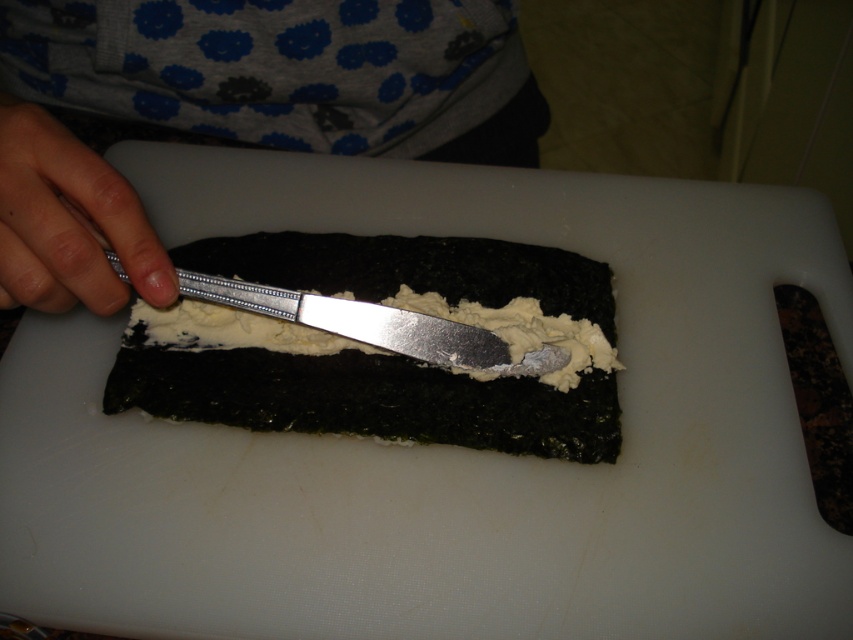
You are a chef standing at the counter and want to reach the point at coordinate point (134, 387). Your arm can extend 24 inches. Can you reach it?

The distance between point (134, 387) and the camera is 24.83 inches. Since your arm can only extend 24 inches, you cannot reach it.

You are a photographer trying to capture the perfect shot of the sushi preparation. You notice two points in the scene labeled as point (283, 420) and point (80, 196). Which point should you focus on to ensure the closest object is in sharp focus?

Point (283, 420) is further to the camera than point (80, 196), so focusing on point (283, 420) will ensure the closest object is in sharp focus.

You are a chef looking at the image of the sushi preparation. Where is the gray fabric at upper center located in the image?

The gray fabric at upper center is located at point coordinates of (231, 109).